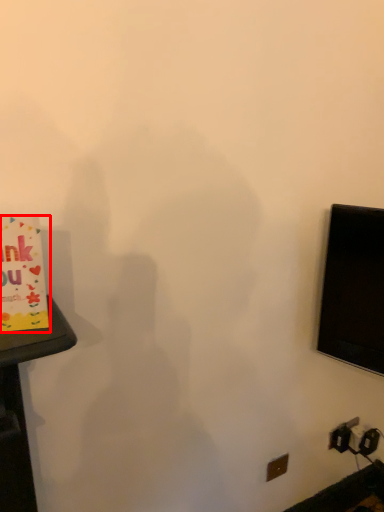
Question: From the image's perspective, what is the correct spatial positioning of birthday card (annotated by the red box) in reference to electric outlet?

Choices:
 (A) below
 (B) above

Answer: (B)